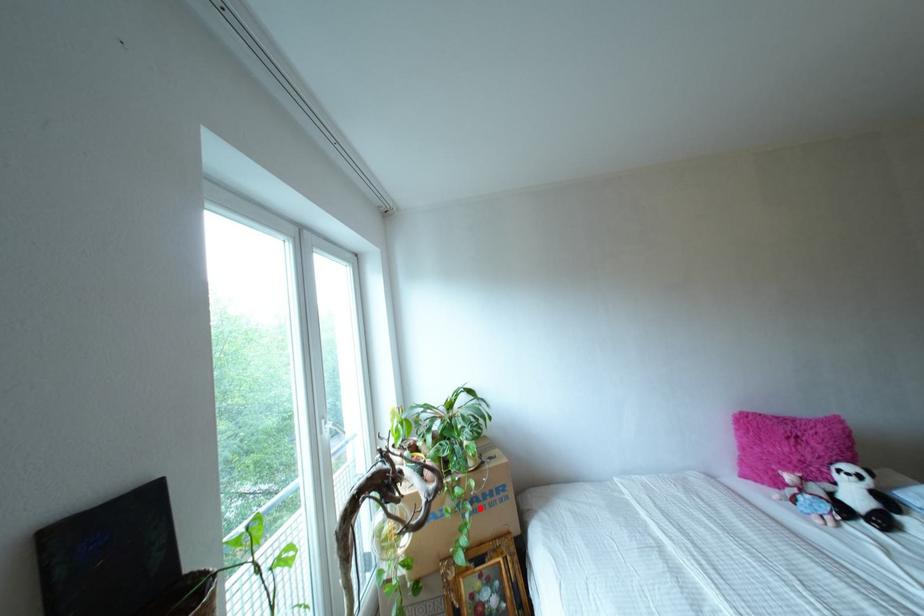
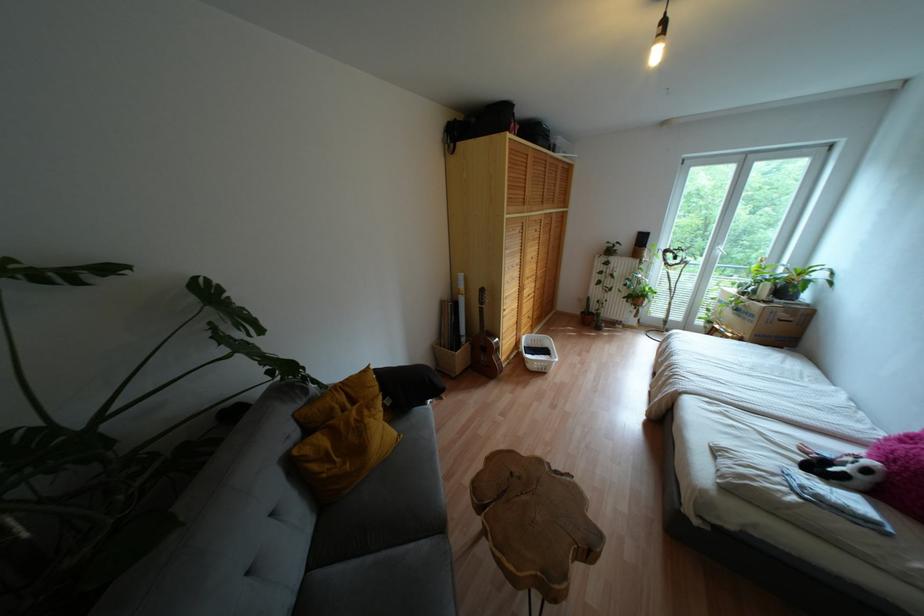
Locate, in the second image, the point that corresponds to the highlighted location in the first image.

(737, 315)